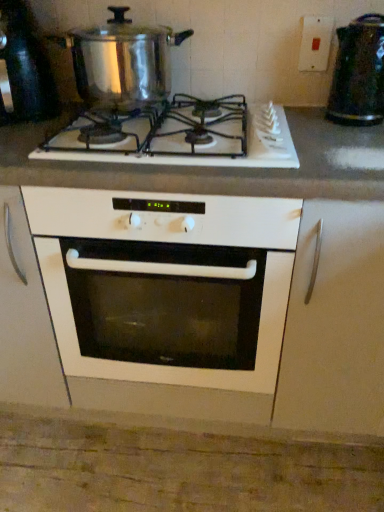
Where is `vacant space to the left of metallic textured kettle at upper right, acting as the second appliance starting from the left`? The image size is (384, 512). vacant space to the left of metallic textured kettle at upper right, acting as the second appliance starting from the left is located at coordinates (307, 120).